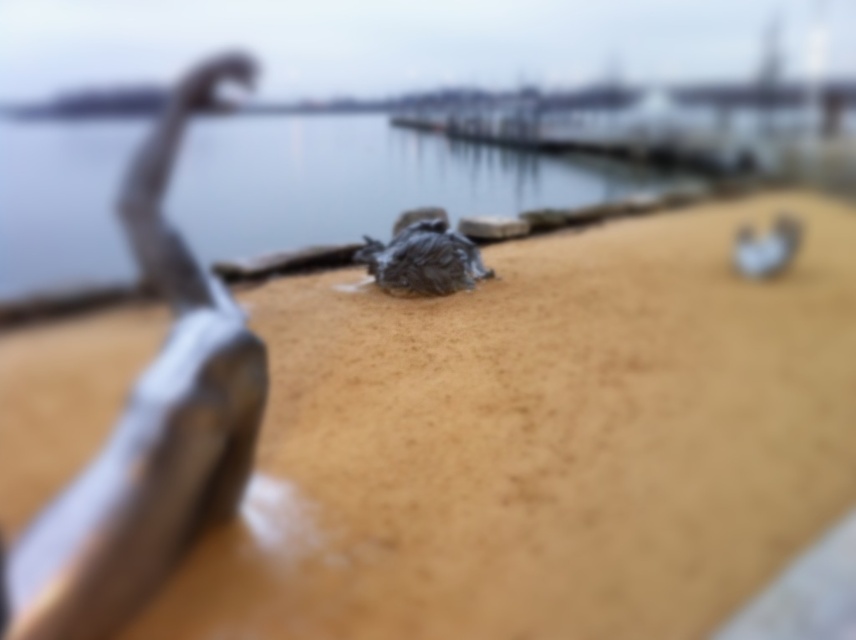
Based on the photo, you are standing on the deck of a boat and see the brown matte sand at center and the clear water at center. Which one is wider?

The clear water at center is wider than the brown matte sand at center because the brown matte sand at center has a smaller width.

You are a safety inspector on a ship. You notice the clear water at center and the metallic silver sculpture at left. Which object is located above the other?

The clear water at center is positioned over metallic silver sculpture at left, so the clear water at center is above the metallic silver sculpture at left.

You are standing on the deck of a boat and see the clear water at center and the metallic silver sculpture at left. Which object is positioned to the right of the other?

The clear water at center is to the right of the metallic silver sculpture at left.